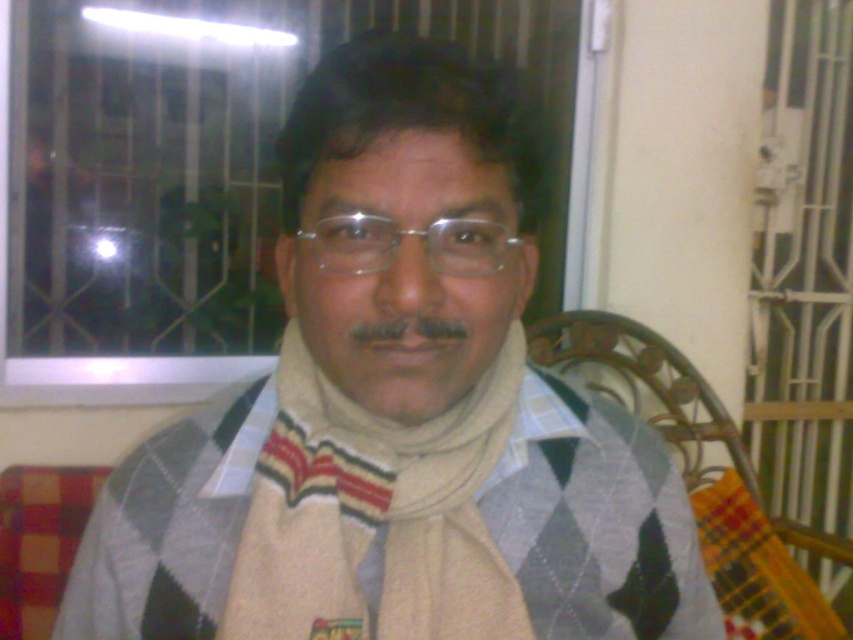
Between point (450, 529) and point (439, 268), which one is positioned in front?

Point (439, 268) is more forward.

Consider the image. Who is taller, beige knitted scarf at center or clear plastic glasses at center?

With more height is beige knitted scarf at center.

Is point (273, 548) in front of point (387, 248)?

No, (273, 548) is behind (387, 248).

Locate an element on the screen. Image resolution: width=853 pixels, height=640 pixels. beige knitted scarf at center is located at coordinates (375, 515).